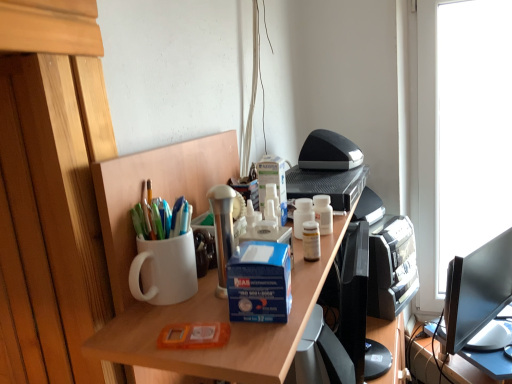
The image size is (512, 384). I want to click on vacant space situated on the left part of orange plastic case at center, the 2th stationery viewed from the right, so click(x=136, y=333).